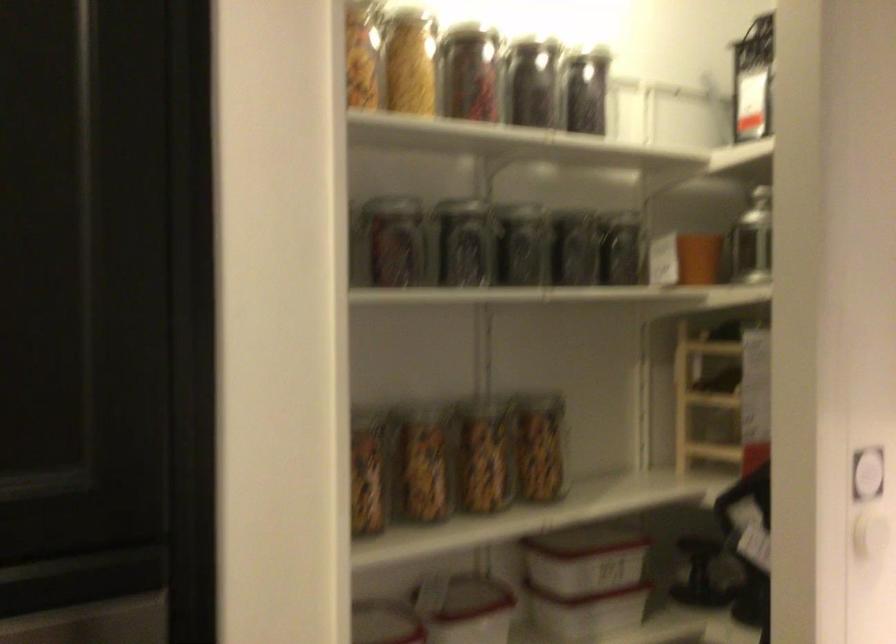
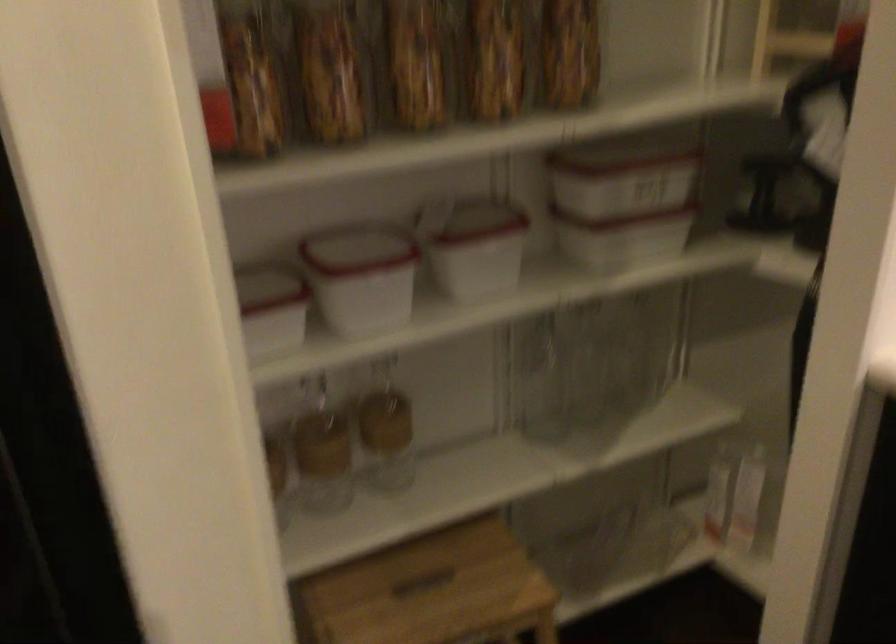
The images are taken continuously from a first-person perspective. In which direction are you moving?

The movement direction of the cameraman is right, forward.